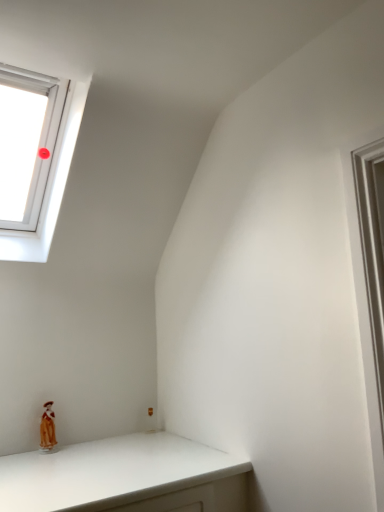
Question: From the image's perspective, would you say porcelain doll at lower left is positioned over white plastic window at upper left?

Choices:
 (A) no
 (B) yes

Answer: (A)

Question: Considering the relative sizes of porcelain doll at lower left and white plastic window at upper left in the image provided, is porcelain doll at lower left taller than white plastic window at upper left?

Choices:
 (A) no
 (B) yes

Answer: (A)

Question: Is porcelain doll at lower left smaller than white plastic window at upper left?

Choices:
 (A) no
 (B) yes

Answer: (B)

Question: Is porcelain doll at lower left further to the viewer compared to white plastic window at upper left?

Choices:
 (A) yes
 (B) no

Answer: (A)

Question: Considering the relative positions of porcelain doll at lower left and white plastic window at upper left in the image provided, is porcelain doll at lower left in front of white plastic window at upper left?

Choices:
 (A) no
 (B) yes

Answer: (A)

Question: Could you tell me if porcelain doll at lower left is turned towards white plastic window at upper left?

Choices:
 (A) yes
 (B) no

Answer: (B)

Question: Can you confirm if white plastic window at upper left is shorter than porcelain doll at lower left?

Choices:
 (A) yes
 (B) no

Answer: (B)

Question: Considering the relative sizes of white plastic window at upper left and porcelain doll at lower left in the image provided, is white plastic window at upper left wider than porcelain doll at lower left?

Choices:
 (A) no
 (B) yes

Answer: (B)

Question: From the image's perspective, is white plastic window at upper left over porcelain doll at lower left?

Choices:
 (A) yes
 (B) no

Answer: (A)

Question: Does white plastic window at upper left have a larger size compared to porcelain doll at lower left?

Choices:
 (A) yes
 (B) no

Answer: (A)

Question: Is white plastic window at upper left directly adjacent to porcelain doll at lower left?

Choices:
 (A) no
 (B) yes

Answer: (A)

Question: Can you confirm if white plastic window at upper left is thinner than porcelain doll at lower left?

Choices:
 (A) yes
 (B) no

Answer: (B)

Question: From the image's perspective, is white plastic window at upper left above or below porcelain doll at lower left?

Choices:
 (A) above
 (B) below

Answer: (A)